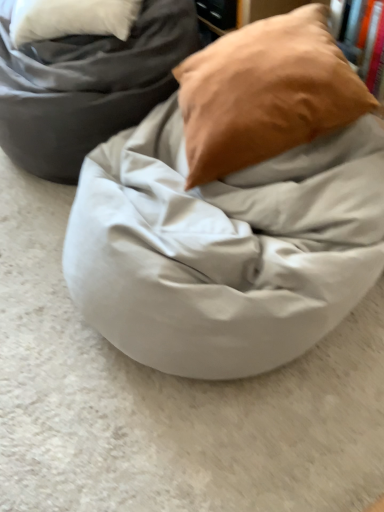
Question: From the image's perspective, is matte brown pillow at upper right positioned above or below matte gray bean bag at center?

Choices:
 (A) below
 (B) above

Answer: (A)

Question: Considering the positions of point (236, 104) and point (46, 158), is point (236, 104) closer or farther from the camera than point (46, 158)?

Choices:
 (A) farther
 (B) closer

Answer: (B)

Question: Based on their relative distances, which object is nearer to the matte brown pillow at upper right?

Choices:
 (A) matte white bean bag at center
 (B) matte gray bean bag at center

Answer: (A)

Question: Which object is positioned closest to the matte white bean bag at center?

Choices:
 (A) matte brown pillow at upper right
 (B) matte gray bean bag at center

Answer: (A)